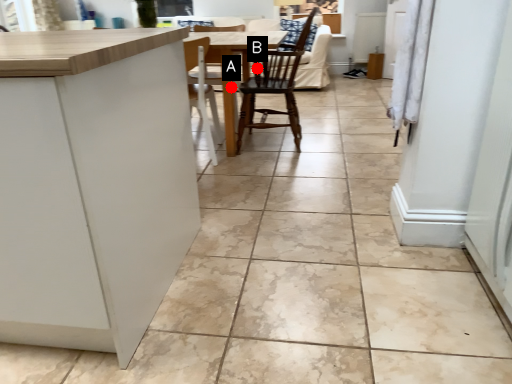
Question: Two points are circled on the image, labeled by A and B beside each circle. Which of the following is the closest to the observer?

Choices:
 (A) A is closer
 (B) B is closer

Answer: (A)